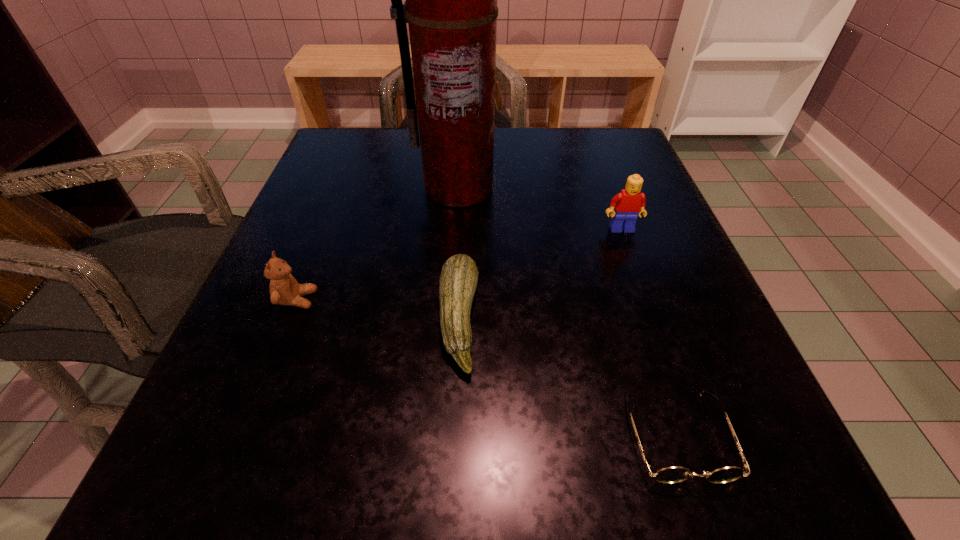
Identify the location of the farthest object. (451, 9).

Locate an element on the screen. the tallest object is located at coordinates (451, 9).

Where is `the fourth shortest object`? The width and height of the screenshot is (960, 540). the fourth shortest object is located at coordinates (628, 204).

Where is `the fourth nearest object`? The image size is (960, 540). the fourth nearest object is located at coordinates (628, 204).

Where is `teddy bear`? The image size is (960, 540). teddy bear is located at coordinates (284, 289).

Identify the location of the leftmost object. (284, 289).

Where is `the second shortest object`? the second shortest object is located at coordinates (459, 276).

This screenshot has height=540, width=960. Find the location of `the nearest object`. the nearest object is located at coordinates (669, 475).

The image size is (960, 540). What are the coordinates of `the shortest object` in the screenshot? It's located at (669, 475).

Identify the location of free space located on the side of the farthest object with the handle and hose. (446, 360).